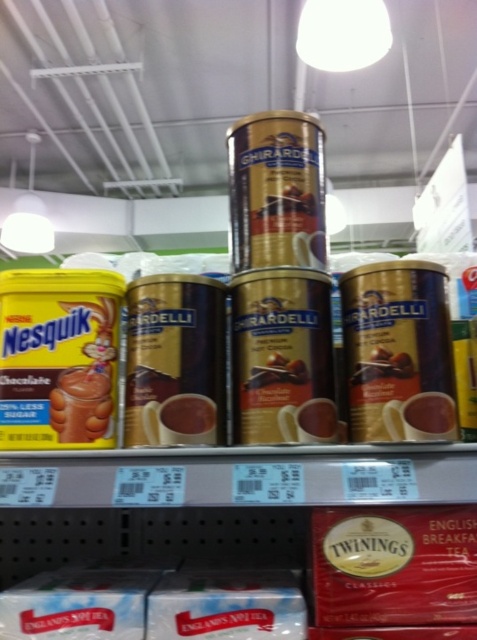
Is yellow matte nesquik chocolate at left further to camera compared to tea bag packaging at center?

Yes, it is behind tea bag packaging at center.

Where is `yellow matte nesquik chocolate at left`? yellow matte nesquik chocolate at left is located at coordinates click(x=59, y=356).

Which of these two, yellow matte nesquik chocolate at left or metallic gold canister at center-right, stands taller?

yellow matte nesquik chocolate at left is taller.

Can you confirm if yellow matte nesquik chocolate at left is smaller than metallic gold canister at center-right?

No.

Measure the distance between point (78, 392) and camera.

Point (78, 392) and camera are 76.07 centimeters apart.

You are a GUI agent. You are given a task and a screenshot of the screen. Output one action in this format:
    pyautogui.click(x=<x>, y=<y>)
    Task: Click on the yellow matte nesquik chocolate at left
    This screenshot has width=477, height=640.
    Given the screenshot: What is the action you would take?
    pyautogui.click(x=59, y=356)

The height and width of the screenshot is (640, 477). Identify the location of yellow matte nesquik chocolate at left. (59, 356).

How distant is yellow matte nesquik chocolate at left from metallic gold canister at center?

yellow matte nesquik chocolate at left is 3.33 inches from metallic gold canister at center.

Is point (87, 374) closer to viewer compared to point (165, 280)?

Yes, it is in front of point (165, 280).

The height and width of the screenshot is (640, 477). I want to click on yellow matte nesquik chocolate at left, so click(59, 356).